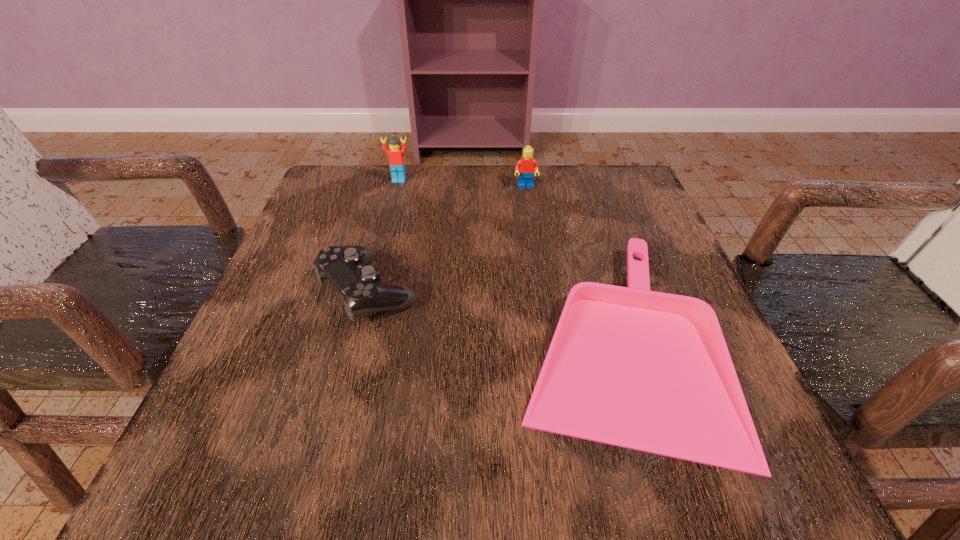
I want to click on vacant space located 0.260m on the handle side of the shortest object, so click(x=350, y=341).

This screenshot has height=540, width=960. Find the location of `free spot located on the handle side of the shortest object`. free spot located on the handle side of the shortest object is located at coordinates (262, 341).

Identify the location of object that is at the near edge. This screenshot has width=960, height=540. (650, 371).

At what (x,y) coordinates should I click in order to perform the action: click on Lego that is at the left edge. Please return your answer as a coordinate pair (x, y). Looking at the image, I should click on click(x=396, y=161).

At what (x,y) coordinates should I click in order to perform the action: click on control situated at the left edge. Please return your answer as a coordinate pair (x, y). This screenshot has width=960, height=540. Looking at the image, I should click on (345, 267).

You are a GUI agent. You are given a task and a screenshot of the screen. Output one action in this format:
    pyautogui.click(x=<x>, y=<y>)
    Task: Click on the object located in the right edge section of the desktop
    The image size is (960, 540).
    Given the screenshot: What is the action you would take?
    (650, 371)

The width and height of the screenshot is (960, 540). Find the location of `object that is positioned at the far left corner`. object that is positioned at the far left corner is located at coordinates (396, 161).

Locate an element on the screen. object situated at the near right corner is located at coordinates (650, 371).

Where is `vacant region at the far edge of the desktop`? The image size is (960, 540). vacant region at the far edge of the desktop is located at coordinates (496, 214).

In order to click on vacant space at the near edge in this screenshot , I will do `click(535, 436)`.